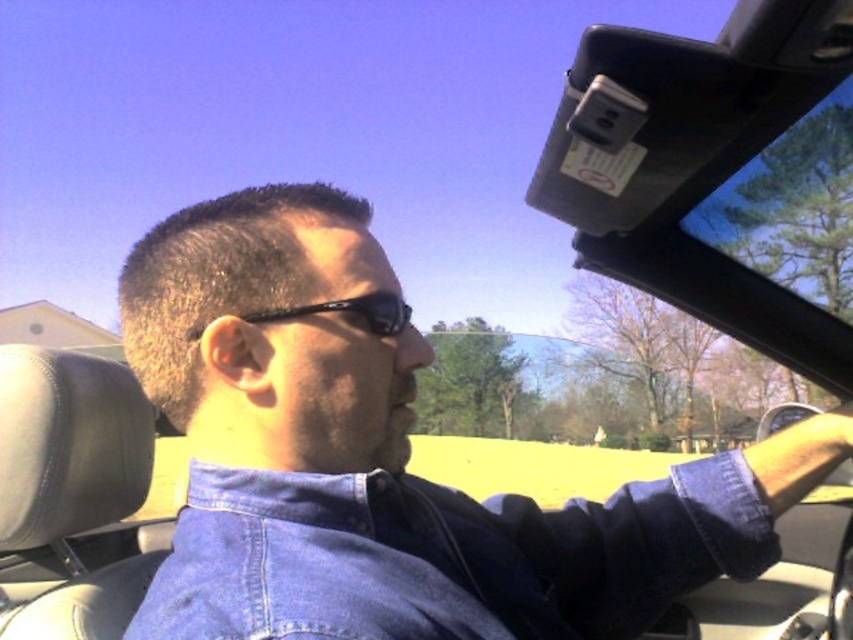
Question: Considering the real-world distances, which object is farthest from the metallic gray rearview mirror at upper right?

Choices:
 (A) black reflective sunglasses at center
 (B) faded denim jacket at lower right

Answer: (A)

Question: Is black reflective sunglasses at center further to camera compared to metallic gray rearview mirror at upper right?

Choices:
 (A) no
 (B) yes

Answer: (A)

Question: Where is faded denim jacket at lower right located in relation to black reflective sunglasses at center in the image?

Choices:
 (A) right
 (B) left

Answer: (A)

Question: Does faded denim jacket at lower right lie behind metallic gray rearview mirror at upper right?

Choices:
 (A) no
 (B) yes

Answer: (A)

Question: Which object is farther from the camera taking this photo?

Choices:
 (A) faded denim jacket at lower right
 (B) black reflective sunglasses at center
 (C) metallic gray rearview mirror at upper right

Answer: (C)

Question: Among these points, which one is nearest to the camera?

Choices:
 (A) (386, 316)
 (B) (734, 476)
 (C) (828, 480)

Answer: (A)